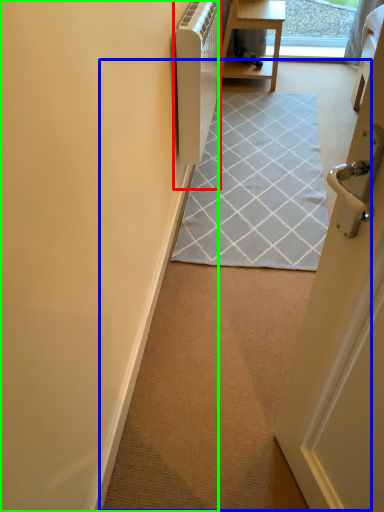
Question: Which is nearer to the appliance (highlighted by a red box)? path (highlighted by a blue box) or door (highlighted by a green box).

Choices:
 (A) path
 (B) door

Answer: (B)